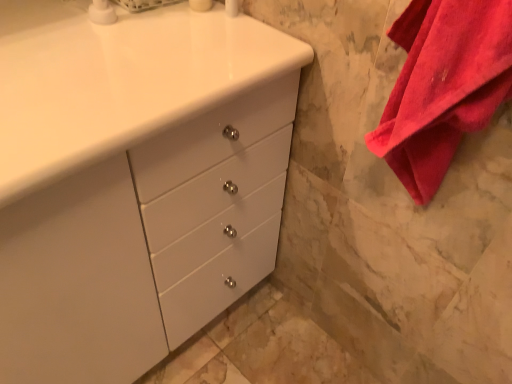
Question: From the image's perspective, is white glossy cabinet at center below red cotton towel at right?

Choices:
 (A) yes
 (B) no

Answer: (A)

Question: Can you confirm if white glossy cabinet at center is bigger than red cotton towel at right?

Choices:
 (A) no
 (B) yes

Answer: (B)

Question: Would you consider white glossy cabinet at center to be distant from red cotton towel at right?

Choices:
 (A) yes
 (B) no

Answer: (B)

Question: Is white glossy cabinet at center oriented away from red cotton towel at right?

Choices:
 (A) yes
 (B) no

Answer: (B)

Question: Considering the relative positions of white glossy cabinet at center and red cotton towel at right in the image provided, is white glossy cabinet at center to the right of red cotton towel at right from the viewer's perspective?

Choices:
 (A) no
 (B) yes

Answer: (A)

Question: From a real-world perspective, is white glossy cabinet at center located higher than red cotton towel at right?

Choices:
 (A) no
 (B) yes

Answer: (A)

Question: Considering the relative positions of red cotton towel at right and white glossy cabinet at center in the image provided, is red cotton towel at right behind white glossy cabinet at center?

Choices:
 (A) yes
 (B) no

Answer: (B)

Question: Can you confirm if red cotton towel at right is smaller than white glossy cabinet at center?

Choices:
 (A) yes
 (B) no

Answer: (A)

Question: Considering the relative positions of red cotton towel at right and white glossy cabinet at center in the image provided, is red cotton towel at right to the right of white glossy cabinet at center from the viewer's perspective?

Choices:
 (A) yes
 (B) no

Answer: (A)

Question: Is red cotton towel at right outside of white glossy cabinet at center?

Choices:
 (A) no
 (B) yes

Answer: (B)

Question: Considering the relative sizes of red cotton towel at right and white glossy cabinet at center in the image provided, is red cotton towel at right taller than white glossy cabinet at center?

Choices:
 (A) yes
 (B) no

Answer: (B)

Question: From a real-world perspective, is red cotton towel at right positioned under white glossy cabinet at center based on gravity?

Choices:
 (A) yes
 (B) no

Answer: (B)

Question: Is red cotton towel at right at the back of white glossy soap dispenser at upper left?

Choices:
 (A) yes
 (B) no

Answer: (B)